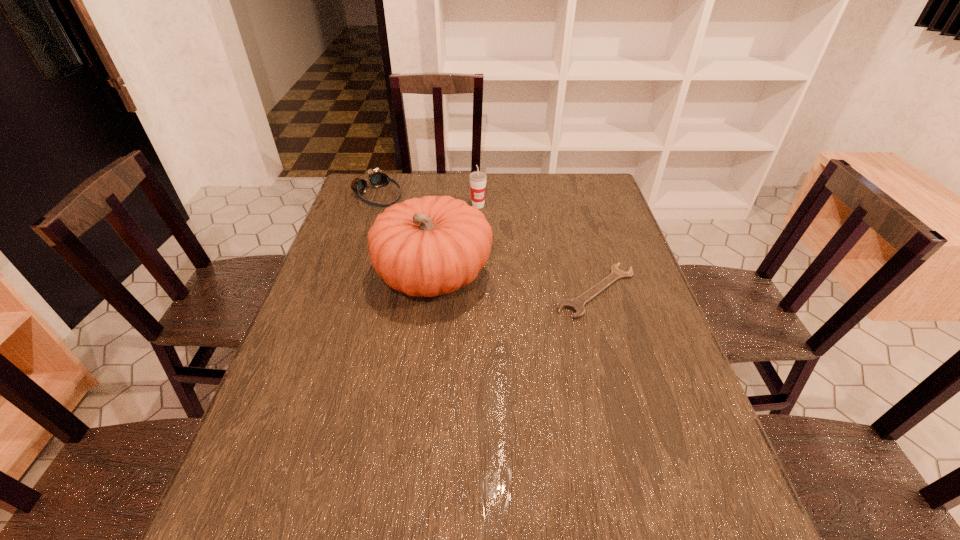
Image resolution: width=960 pixels, height=540 pixels. In the image, there is a desktop. What are the coordinates of `vacant space at the left edge` in the screenshot? It's located at (316, 300).

Locate an element on the screen. The height and width of the screenshot is (540, 960). vacant area at the right edge of the desktop is located at coordinates (594, 264).

At what (x,y) coordinates should I click in order to perform the action: click on vacant space at the near left corner of the desktop. Please return your answer as a coordinate pair (x, y). Image resolution: width=960 pixels, height=540 pixels. Looking at the image, I should click on (267, 457).

Find the location of a particular element. The width and height of the screenshot is (960, 540). vacant space at the far right corner of the desktop is located at coordinates (590, 178).

You are a GUI agent. You are given a task and a screenshot of the screen. Output one action in this format:
    pyautogui.click(x=<x>, y=<y>)
    Task: Click on the vacant area that lies between the cup and the rightmost object
    This screenshot has width=960, height=540.
    Given the screenshot: What is the action you would take?
    pyautogui.click(x=538, y=248)

Identify the location of empty location between the tallest object and the rightmost object. (515, 284).

The image size is (960, 540). What are the coordinates of `unoccupied position between the wrench and the tallest object` in the screenshot? It's located at (515, 284).

Identify which object is the third closest to the shortest object. Please provide its 2D coordinates. Your answer should be formatted as a tuple, i.e. [(x, y)], where the tuple contains the x and y coordinates of a point satisfying the conditions above.

[(377, 179)]

The height and width of the screenshot is (540, 960). Identify the location of object that is the nearest to the second shortest object. (434, 245).

Find the location of `vacant space that satisfies the following two spatial constraints: 1. on the front side of the wrench; 2. on the right side of the pumpkin`. vacant space that satisfies the following two spatial constraints: 1. on the front side of the wrench; 2. on the right side of the pumpkin is located at coordinates (431, 291).